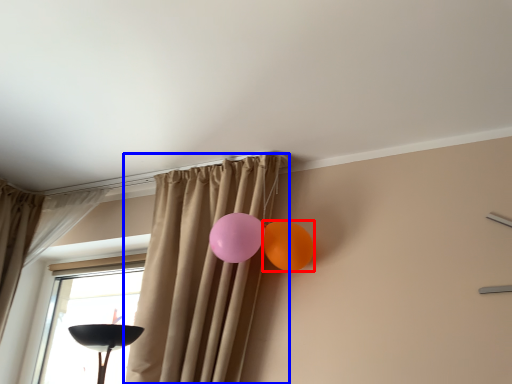
Question: Among these objects, which one is farthest to the camera, balloon (highlighted by a red box) or curtain (highlighted by a blue box)?

Choices:
 (A) balloon
 (B) curtain

Answer: (A)